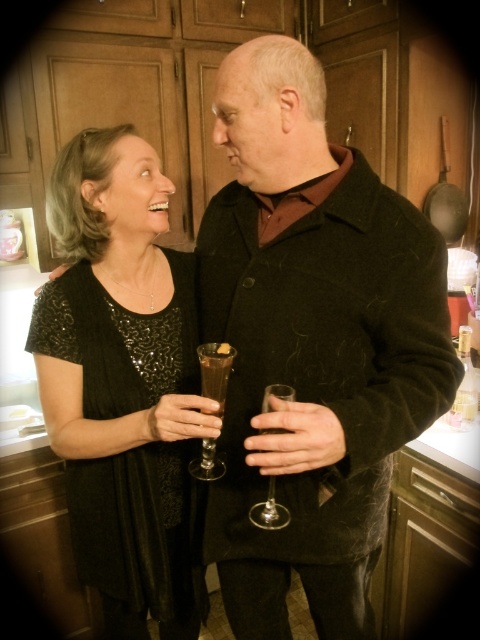
From the picture: You are at a dinner party and see two glasses at the center of the table. The brown glass at center is to the right of the translucent glass at center. Which glass should you pour the wine into if you want to follow the traditional placement?

You should pour the wine into the translucent glass at center because the brown glass at center is to its right, indicating it might be for a different beverage like water or juice.

You are a photographer setting up for a photoshoot in this kitchen scene. You need to position a backdrop that must be wider than both the black sequined dress at left and the translucent glass at center. Based on the scene description, can you confirm if the backdrop you have, which is 1.5 meters wide, will be wide enough to cover both objects?

The black sequined dress at left is wider than the translucent glass at center. Since the backdrop is 1.5 meters wide, it must be wider than both objects. Therefore, the backdrop should be sufficient to cover both objects as long as its width exceeds the widest object, which is the black sequined dress at left.

You are standing in the kitchen and want to take a photo of the black sequined dress at left. Where should you position yourself to capture the dress in the frame?

To capture the black sequined dress at left in the frame, position yourself so that the dress is centered at coordinates approximately 0.595 on the horizontal axis and 0.254 on the vertical axis.